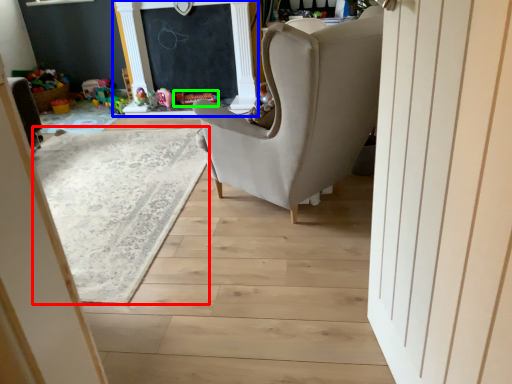
Question: Estimate the real-world distances between objects in this image. Which object is farther from plain (highlighted by a red box), fireplace (highlighted by a blue box) or toy (highlighted by a green box)?

Choices:
 (A) fireplace
 (B) toy

Answer: (B)